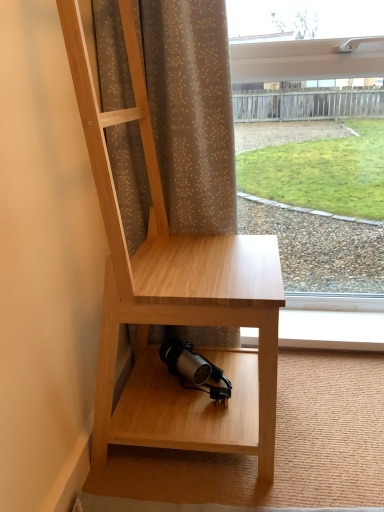
Question: Is natural wood desk at center located within brown sheer curtain at upper center?

Choices:
 (A) yes
 (B) no

Answer: (B)

Question: Does brown sheer curtain at upper center have a larger size compared to natural wood desk at center?

Choices:
 (A) no
 (B) yes

Answer: (A)

Question: Does brown sheer curtain at upper center have a greater width compared to natural wood desk at center?

Choices:
 (A) yes
 (B) no

Answer: (B)

Question: Is brown sheer curtain at upper center to the left of natural wood desk at center from the viewer's perspective?

Choices:
 (A) yes
 (B) no

Answer: (A)

Question: Is brown sheer curtain at upper center shorter than natural wood desk at center?

Choices:
 (A) no
 (B) yes

Answer: (B)

Question: Does brown sheer curtain at upper center come behind natural wood desk at center?

Choices:
 (A) yes
 (B) no

Answer: (A)

Question: Is natural wood desk at center positioned with its back to brown sheer curtain at upper center?

Choices:
 (A) no
 (B) yes

Answer: (A)

Question: Is natural wood desk at center positioned in front of brown sheer curtain at upper center?

Choices:
 (A) no
 (B) yes

Answer: (B)

Question: Is brown sheer curtain at upper center inside natural wood desk at center?

Choices:
 (A) no
 (B) yes

Answer: (A)

Question: Considering the relative sizes of natural wood desk at center and brown sheer curtain at upper center in the image provided, is natural wood desk at center bigger than brown sheer curtain at upper center?

Choices:
 (A) no
 (B) yes

Answer: (B)

Question: Considering the relative sizes of natural wood desk at center and brown sheer curtain at upper center in the image provided, is natural wood desk at center wider than brown sheer curtain at upper center?

Choices:
 (A) yes
 (B) no

Answer: (A)

Question: Is natural wood desk at center with brown sheer curtain at upper center?

Choices:
 (A) yes
 (B) no

Answer: (B)

Question: Is transparent glass window at upper right wider than natural wood desk at center?

Choices:
 (A) yes
 (B) no

Answer: (B)